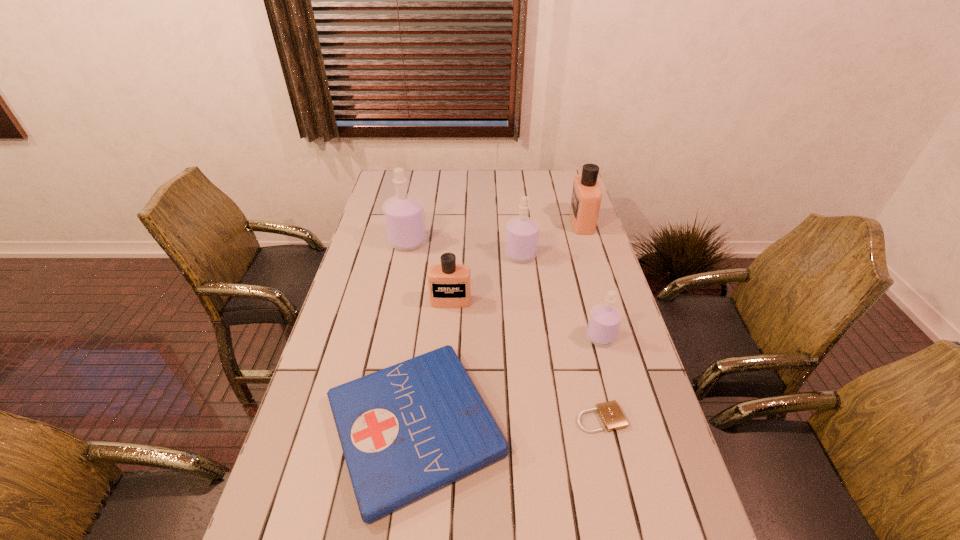
At what (x,y) coordinates should I click in order to perform the action: click on vacant area between the beige padlock and the fourth farthest object. Please return your answer as a coordinate pair (x, y). Looking at the image, I should click on (525, 360).

You are a GUI agent. You are given a task and a screenshot of the screen. Output one action in this format:
    pyautogui.click(x=<x>, y=<y>)
    Task: Click on the blank region between the fourth object from left to right and the nearest perfume
    This screenshot has width=960, height=540.
    Given the screenshot: What is the action you would take?
    pyautogui.click(x=561, y=296)

Locate an element on the screen. empty location between the tallest perfume and the padlock is located at coordinates (504, 330).

Find the location of a particular element. vacant space that is in between the shortest object and the second purple perfume from right to left is located at coordinates (561, 336).

Identify the location of free space between the rightmost purple perfume and the beige padlock. (600, 377).

Where is `unoccupied area between the blue first-aid kit and the tallest perfume`? Image resolution: width=960 pixels, height=540 pixels. unoccupied area between the blue first-aid kit and the tallest perfume is located at coordinates (411, 334).

This screenshot has width=960, height=540. What are the coordinates of `free space between the fourth object from left to right and the bigger beige perfume` in the screenshot? It's located at (551, 239).

The image size is (960, 540). What are the coordinates of `the second closest object relative to the smallest purple perfume` in the screenshot? It's located at (406, 431).

Locate an element on the screen. The width and height of the screenshot is (960, 540). object that can be found as the sixth closest to the leftmost perfume is located at coordinates (612, 417).

Find the location of a particular element. Image resolution: width=960 pixels, height=540 pixels. perfume that stands as the second closest to the smaller beige perfume is located at coordinates (404, 216).